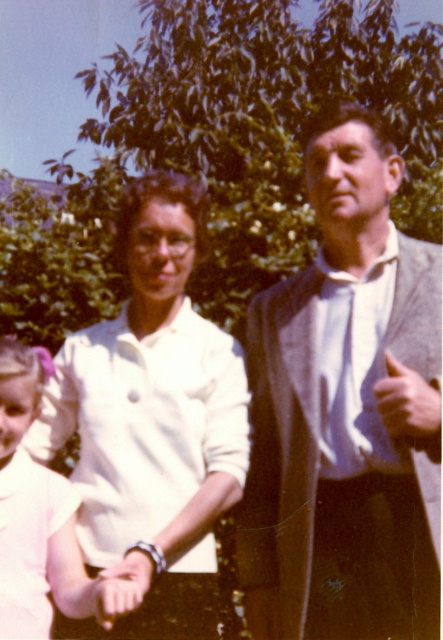
Question: Is gray wool sweater at right to the right of smooth leather wristwatch at center from the viewer's perspective?

Choices:
 (A) no
 (B) yes

Answer: (B)

Question: Does light pink fabric dress at center come behind smooth skin hand at right?

Choices:
 (A) yes
 (B) no

Answer: (B)

Question: Considering the real-world distances, which object is closest to the light pink fabric dress at center?

Choices:
 (A) smooth leather wristwatch at center
 (B) smooth skin hand at right
 (C) gray wool sweater at right
 (D) white matte shirt at center

Answer: (D)

Question: Does light pink fabric dress at center come behind smooth skin hand at right?

Choices:
 (A) yes
 (B) no

Answer: (B)

Question: Among these objects, which one is farthest from the camera?

Choices:
 (A) smooth leather wristwatch at center
 (B) smooth skin hand at right

Answer: (B)

Question: Which point appears farthest from the camera in this image?

Choices:
 (A) (339, 234)
 (B) (439, 417)
 (C) (237, 397)

Answer: (C)